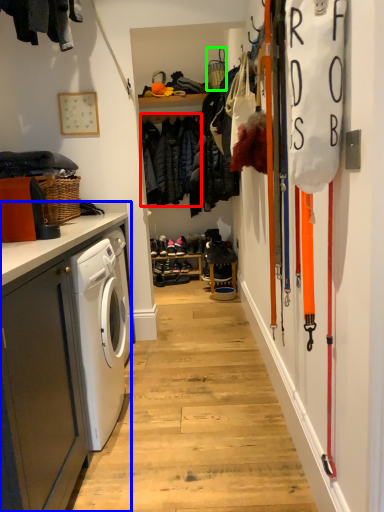
Question: Which object is the closest to the clothing (highlighted by a red box)? Choose among these: cabinetry (highlighted by a blue box) or basket (highlighted by a green box).

Choices:
 (A) cabinetry
 (B) basket

Answer: (B)